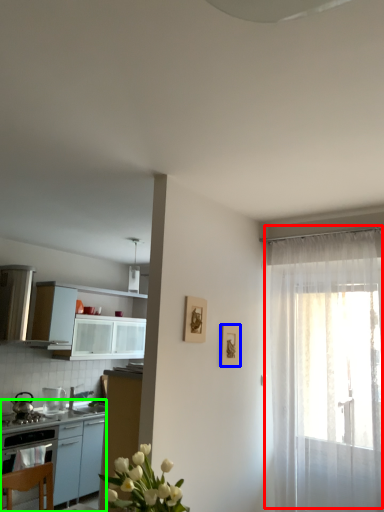
Question: Which is farther away from curtain (highlighted by a red box)? picture frame (highlighted by a blue box) or table (highlighted by a green box)?

Choices:
 (A) picture frame
 (B) table

Answer: (B)